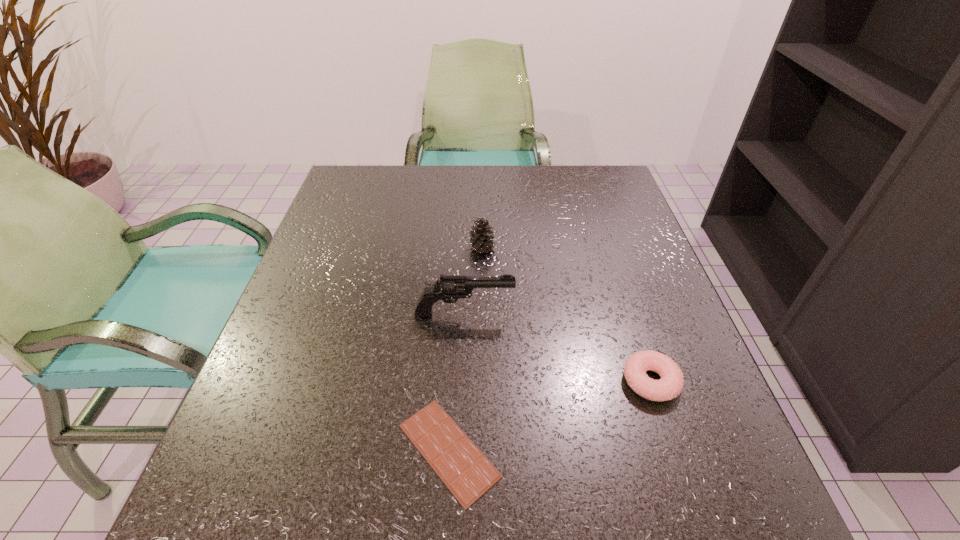
This screenshot has width=960, height=540. I want to click on gun, so click(450, 288).

This screenshot has width=960, height=540. In order to click on the third nearest object in this screenshot , I will do (x=450, y=288).

In order to click on pinecone in this screenshot , I will do `click(481, 238)`.

Find the location of a particular element. the farthest object is located at coordinates (481, 238).

I want to click on doughnut, so click(x=671, y=383).

Find the location of a particular element. The width and height of the screenshot is (960, 540). the third tallest object is located at coordinates [x=671, y=383].

At what (x,y) coordinates should I click in order to perform the action: click on the shortest object. Please return your answer as a coordinate pair (x, y). The width and height of the screenshot is (960, 540). Looking at the image, I should click on (468, 474).

Identify the location of free space located 0.130m at the end of the barrel of the gun. (578, 314).

Identify the location of free location located 0.190m on the back of the pinecone. (482, 197).

Find the location of `free space located 0.390m on the left of the third tallest object`. free space located 0.390m on the left of the third tallest object is located at coordinates (400, 381).